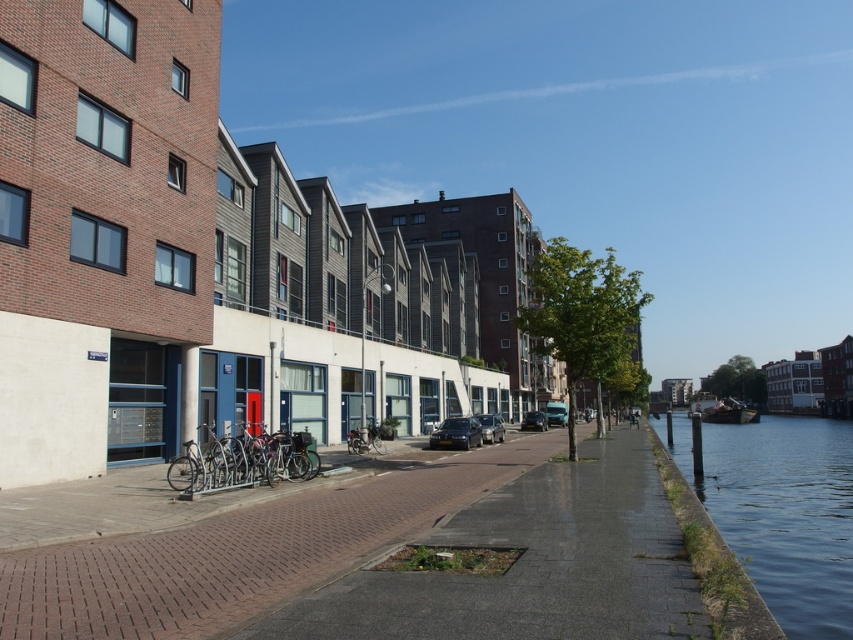
Does brown brick pavement at lower left appear on the right side of shiny black car at center?

In fact, brown brick pavement at lower left is to the left of shiny black car at center.

Is brown brick pavement at lower left further to camera compared to shiny black car at center?

No, brown brick pavement at lower left is closer to the viewer.

Locate an element on the screen. brown brick pavement at lower left is located at coordinates (241, 552).

Which of these two, clear water at lower right or shiny metallic bicycle at center, stands taller?

clear water at lower right is taller.

Is point (733, 429) positioned before point (364, 445)?

No, it is not.

What do you see at coordinates (782, 512) in the screenshot? I see `clear water at lower right` at bounding box center [782, 512].

I want to click on clear water at lower right, so click(x=782, y=512).

Which is more to the left, shiny black sedan at center or shiny metallic bicycle at center?

shiny metallic bicycle at center

Does shiny black sedan at center appear on the right side of shiny metallic bicycle at center?

Yes, shiny black sedan at center is to the right of shiny metallic bicycle at center.

Does point (440, 440) come in front of point (360, 445)?

No.

The height and width of the screenshot is (640, 853). I want to click on shiny black sedan at center, so click(x=456, y=433).